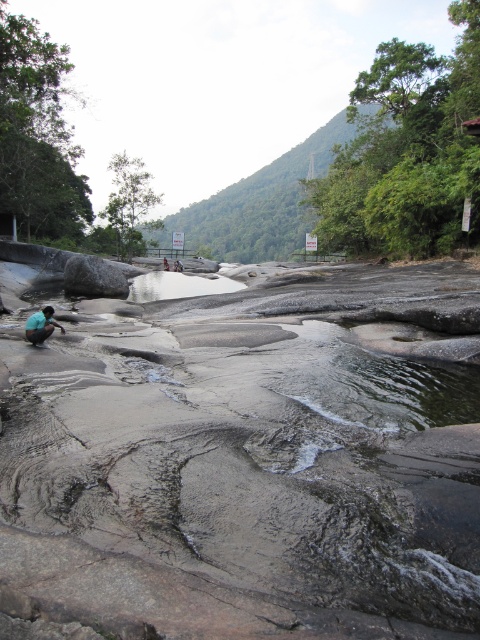
You are a hiker carrying a heavy backpack and need to cross the rocky riverbed. You see the clear glass puddle at center and the teal fabric squat at lower left. Which object should you avoid stepping on to prevent slipping?

You should avoid stepping on the clear glass puddle at center because it is above the teal fabric squat at lower left and likely slippery due to its glass surface and water.

You are a hiker trying to cross the rocky riverbed and avoid getting your feet wet. You see a clear glass puddle at center and a teal fabric squat at lower left. Which object should you step on to stay dry?

The teal fabric squat at lower left is to the right of the clear glass puddle at center, so stepping on the teal fabric squat at lower left would keep you dry as it is not a water puddle.